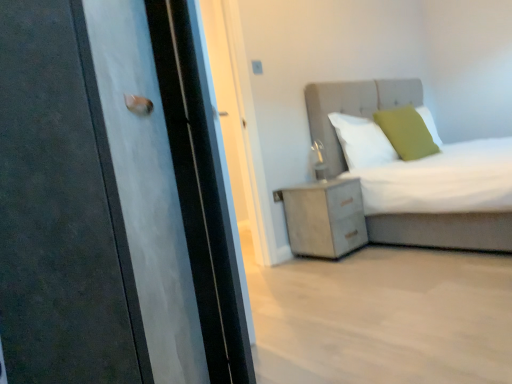
What do you see at coordinates (406, 132) in the screenshot? I see `green matte pillow at upper right, acting as the first pillow starting from the right` at bounding box center [406, 132].

Where is `green matte pillow at upper right, acting as the first pillow starting from the right`? This screenshot has height=384, width=512. green matte pillow at upper right, acting as the first pillow starting from the right is located at coordinates (406, 132).

Find the location of `white soft pillow at upper center, arranged as the 1th pillow when viewed from the left`. white soft pillow at upper center, arranged as the 1th pillow when viewed from the left is located at coordinates (362, 141).

What do you see at coordinates (444, 230) in the screenshot?
I see `matte gray bed at upper right` at bounding box center [444, 230].

Measure the distance between matte gray bed at upper right and camera.

The depth of matte gray bed at upper right is 3.21 meters.

Find the location of a particular element. The width and height of the screenshot is (512, 384). matte black door at left is located at coordinates (60, 210).

From the picture: Relative to green matte pillow at upper right, the second pillow when ordered from left to right, is white textured cabinet at lower right in front or behind?

In the image, white textured cabinet at lower right appears in front of green matte pillow at upper right, the second pillow when ordered from left to right.

Is white textured cabinet at lower right not near green matte pillow at upper right, the second pillow when ordered from left to right?

No.

The image size is (512, 384). What are the coordinates of `nightstand in front of the green matte pillow at upper right, the second pillow when ordered from left to right` in the screenshot? It's located at (324, 217).

Between white textured cabinet at lower right and green matte pillow at upper right, acting as the first pillow starting from the right, which one has smaller width?

green matte pillow at upper right, acting as the first pillow starting from the right, is thinner.

Which point is more forward, (390, 100) or (404, 154)?

Positioned in front is point (404, 154).

From the image's perspective, which one is positioned higher, matte gray bed at upper right or green matte pillow at upper right, acting as the first pillow starting from the right?

green matte pillow at upper right, acting as the first pillow starting from the right, appears higher in the image.

From a real-world perspective, is matte gray bed at upper right under green matte pillow at upper right, acting as the first pillow starting from the right?

Yes, from a real-world perspective, matte gray bed at upper right is under green matte pillow at upper right, acting as the first pillow starting from the right.

Is matte gray bed at upper right positioned with its back to green matte pillow at upper right, the second pillow when ordered from left to right?

Correct, matte gray bed at upper right is looking away from green matte pillow at upper right, the second pillow when ordered from left to right.

Which object is more forward, matte black door at left or white soft pillow at upper center, positioned as the 2th pillow in right-to-left order?

matte black door at left.

Is matte black door at left located outside white soft pillow at upper center, positioned as the 2th pillow in right-to-left order?

Yes, matte black door at left is located beyond the bounds of white soft pillow at upper center, positioned as the 2th pillow in right-to-left order.

Is point (21, 73) in front of point (347, 140)?

Yes, point (21, 73) is in front of point (347, 140).

Is matte black door at left with white soft pillow at upper center, arranged as the 1th pillow when viewed from the left?

No, matte black door at left is not touching white soft pillow at upper center, arranged as the 1th pillow when viewed from the left.

Can you confirm if matte gray bed at upper right is taller than white soft pillow at upper center, positioned as the 2th pillow in right-to-left order?

Indeed, matte gray bed at upper right has a greater height compared to white soft pillow at upper center, positioned as the 2th pillow in right-to-left order.

The image size is (512, 384). I want to click on bed below the white soft pillow at upper center, arranged as the 1th pillow when viewed from the left (from a real-world perspective), so click(x=444, y=230).

Looking at this image, is matte gray bed at upper right positioned behind white soft pillow at upper center, positioned as the 2th pillow in right-to-left order?

No, it is not.

Which object is closer to the camera, matte gray bed at upper right or matte black door at left?

matte black door at left.

Does matte gray bed at upper right appear on the right side of matte black door at left?

Yes.

From the image's perspective, is matte gray bed at upper right located beneath matte black door at left?

No, from the image's perspective, matte gray bed at upper right is not beneath matte black door at left.

I want to click on door on the left of green matte pillow at upper right, acting as the first pillow starting from the right, so click(x=60, y=210).

Which is in front, point (417, 155) or point (127, 324)?

Positioned in front is point (127, 324).

Is green matte pillow at upper right, acting as the first pillow starting from the right, aimed at matte black door at left?

No, green matte pillow at upper right, acting as the first pillow starting from the right, does not turn towards matte black door at left.

What are the coordinates of `pillow below the green matte pillow at upper right, the second pillow when ordered from left to right (from the image's perspective)` in the screenshot? It's located at (362, 141).

Is green matte pillow at upper right, the second pillow when ordered from left to right, not within white soft pillow at upper center, arranged as the 1th pillow when viewed from the left?

green matte pillow at upper right, the second pillow when ordered from left to right, is positioned outside white soft pillow at upper center, arranged as the 1th pillow when viewed from the left.

Can you confirm if green matte pillow at upper right, the second pillow when ordered from left to right, is thinner than white soft pillow at upper center, positioned as the 2th pillow in right-to-left order?

Incorrect, the width of green matte pillow at upper right, the second pillow when ordered from left to right, is not less than that of white soft pillow at upper center, positioned as the 2th pillow in right-to-left order.

Does green matte pillow at upper right, the second pillow when ordered from left to right, appear on the right side of white soft pillow at upper center, positioned as the 2th pillow in right-to-left order?

Yes, green matte pillow at upper right, the second pillow when ordered from left to right, is to the right of white soft pillow at upper center, positioned as the 2th pillow in right-to-left order.

There is a white textured cabinet at lower right. Identify the location of the 1st pillow above it (from a real-world perspective). (406, 132).

At what (x,y) coordinates should I click in order to perform the action: click on the 2nd pillow above when counting from the matte gray bed at upper right (from the image's perspective). Please return your answer as a coordinate pair (x, y). Looking at the image, I should click on (406, 132).

Looking at the image, which one is located further to green matte pillow at upper right, the second pillow when ordered from left to right, white soft pillow at upper center, arranged as the 1th pillow when viewed from the left, or matte black door at left?

matte black door at left lies further to green matte pillow at upper right, the second pillow when ordered from left to right, than the other object.

Considering their positions, is green matte pillow at upper right, acting as the first pillow starting from the right, positioned further to matte black door at left than matte gray bed at upper right?

green matte pillow at upper right, acting as the first pillow starting from the right, is further to matte black door at left.

Which object lies nearer to the anchor point white soft pillow at upper center, positioned as the 2th pillow in right-to-left order, green matte pillow at upper right, acting as the first pillow starting from the right, or matte gray bed at upper right?

matte gray bed at upper right is positioned closer to the anchor white soft pillow at upper center, positioned as the 2th pillow in right-to-left order.

Looking at the image, which one is located further to matte black door at left, white soft pillow at upper center, positioned as the 2th pillow in right-to-left order, or green matte pillow at upper right, acting as the first pillow starting from the right?

Based on the image, green matte pillow at upper right, acting as the first pillow starting from the right, appears to be further to matte black door at left.

Which object lies nearer to the anchor point matte gray bed at upper right, green matte pillow at upper right, acting as the first pillow starting from the right, or white textured cabinet at lower right?

green matte pillow at upper right, acting as the first pillow starting from the right, is positioned closer to the anchor matte gray bed at upper right.

When comparing their distances from white soft pillow at upper center, positioned as the 2th pillow in right-to-left order, does matte black door at left or white textured cabinet at lower right seem further?

matte black door at left is further to white soft pillow at upper center, positioned as the 2th pillow in right-to-left order.

Estimate the real-world distances between objects in this image. Which object is further from white textured cabinet at lower right, matte black door at left or matte gray bed at upper right?

matte black door at left is further to white textured cabinet at lower right.

In the scene shown: From the image, which object appears to be nearer to white textured cabinet at lower right, matte gray bed at upper right or white soft pillow at upper center, arranged as the 1th pillow when viewed from the left?

white soft pillow at upper center, arranged as the 1th pillow when viewed from the left, is positioned closer to the anchor white textured cabinet at lower right.

Locate an element on the screen. The image size is (512, 384). nightstand positioned between matte black door at left and white soft pillow at upper center, positioned as the 2th pillow in right-to-left order, from near to far is located at coordinates (324, 217).

Where is `nightstand located between matte gray bed at upper right and green matte pillow at upper right, the second pillow when ordered from left to right, in the depth direction`? nightstand located between matte gray bed at upper right and green matte pillow at upper right, the second pillow when ordered from left to right, in the depth direction is located at coordinates (324, 217).

Find the location of a particular element. The image size is (512, 384). bed located between matte black door at left and white soft pillow at upper center, positioned as the 2th pillow in right-to-left order, in the depth direction is located at coordinates (444, 230).

You are a GUI agent. You are given a task and a screenshot of the screen. Output one action in this format:
    pyautogui.click(x=<x>, y=<y>)
    Task: Click on the nightstand between matte black door at left and green matte pillow at upper right, acting as the first pillow starting from the right, along the z-axis
    This screenshot has height=384, width=512.
    Given the screenshot: What is the action you would take?
    pyautogui.click(x=324, y=217)